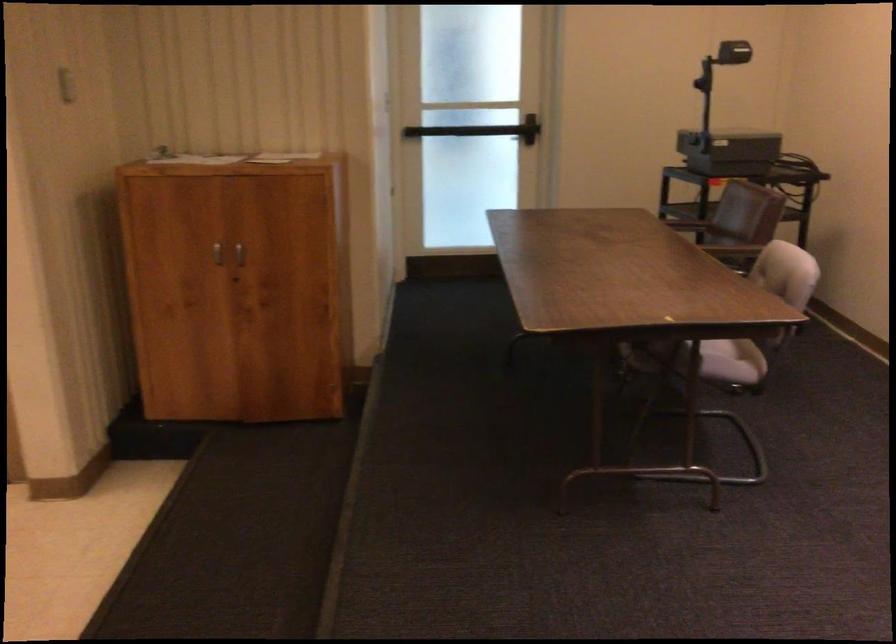
You are a GUI agent. You are given a task and a screenshot of the screen. Output one action in this format:
    pyautogui.click(x=<x>, y=<y>)
    Task: Click on the white paper
    This screenshot has width=896, height=644.
    Given the screenshot: What is the action you would take?
    pyautogui.click(x=227, y=158)